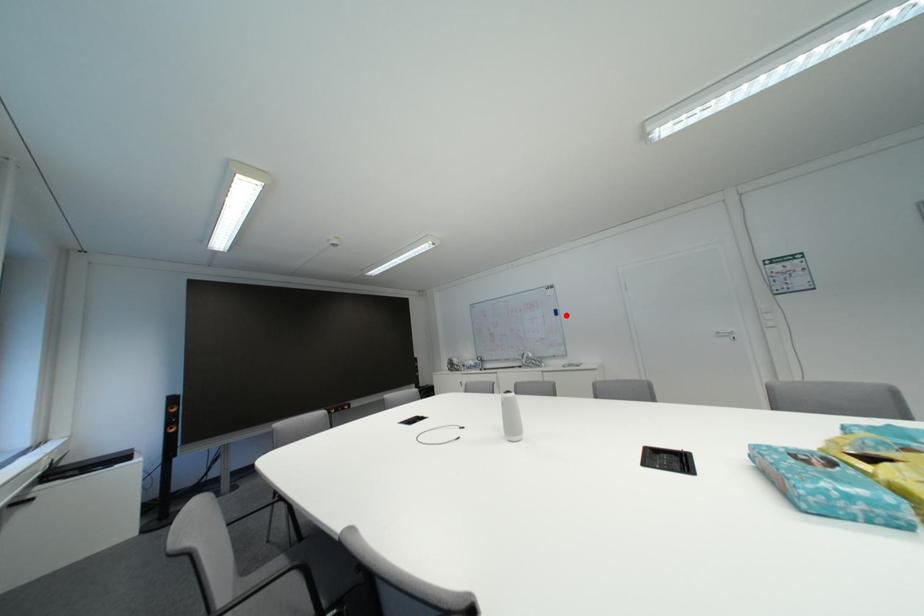
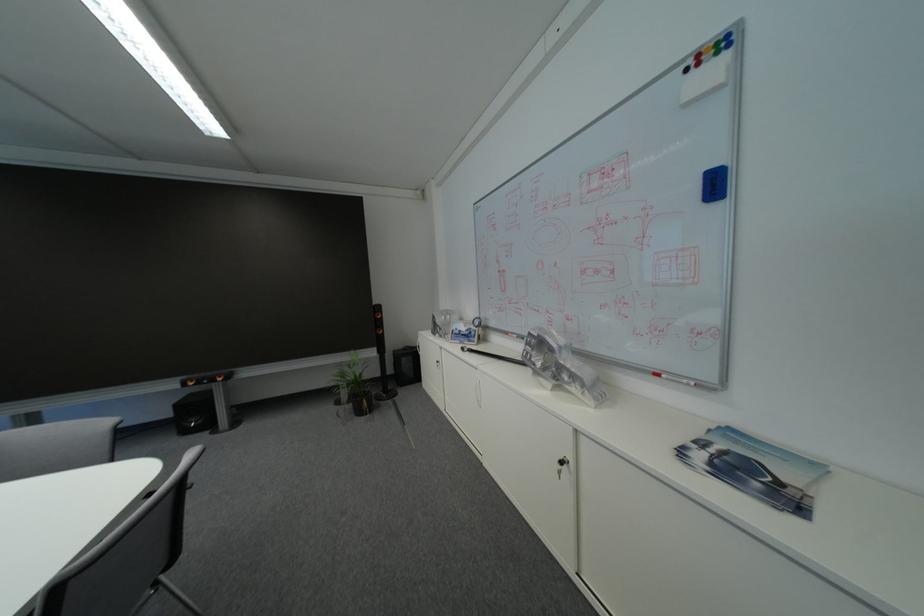
Question: I am providing you with two images of the same scene from different viewpoints. A red point is marked on the first image. Is the red point's position out of view in image 2?

Choices:
 (A) Yes
 (B) No

Answer: (B)